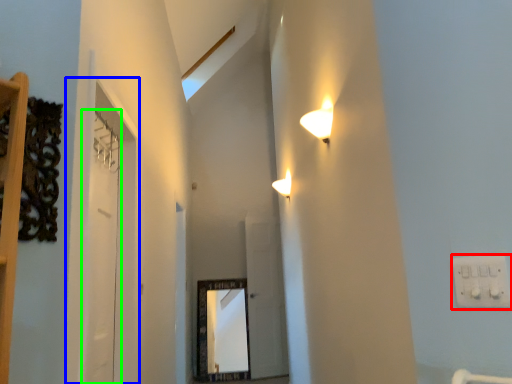
Question: Which object is positioned closest to electric outlet (highlighted by a red box)? Select from glass door (highlighted by a blue box) and door (highlighted by a green box).

Choices:
 (A) glass door
 (B) door

Answer: (A)